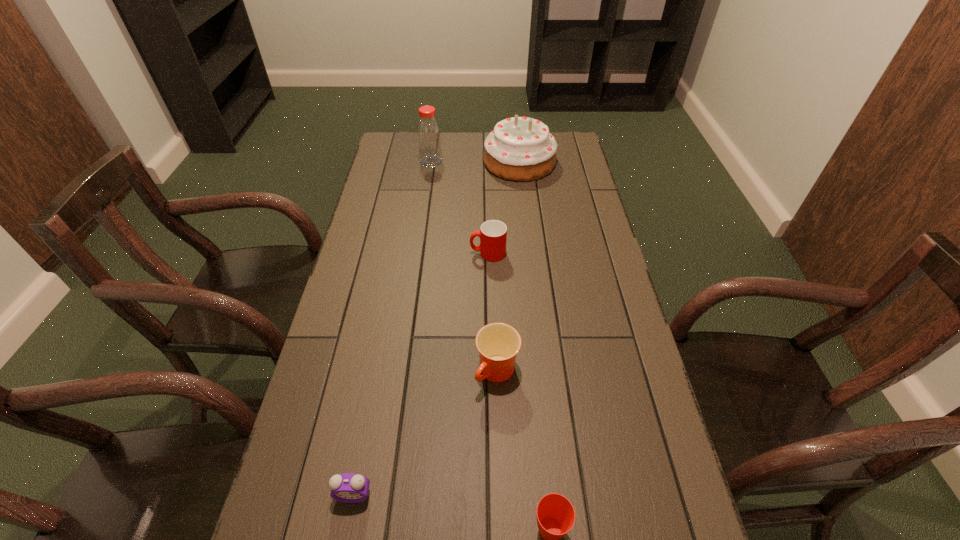
You are a GUI agent. You are given a task and a screenshot of the screen. Output one action in this format:
    pyautogui.click(x=<x>, y=<y>)
    Task: Click on the cup that is the closest to the rightmost cup
    This screenshot has height=540, width=960.
    Given the screenshot: What is the action you would take?
    pyautogui.click(x=498, y=344)

I want to click on the closest cup relative to the fourth farthest object, so click(555, 514).